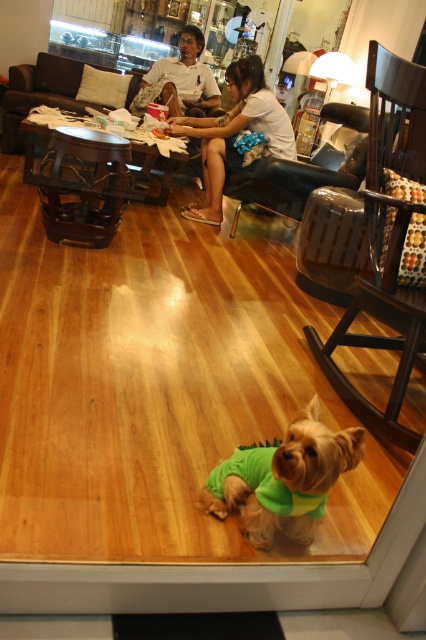
Is white cotton shirt at upper center below matte white shirt at upper center?

Correct, white cotton shirt at upper center is located below matte white shirt at upper center.

Is point (276, 138) farther from camera compared to point (199, 97)?

No, (276, 138) is in front of (199, 97).

Identify the location of white cotton shirt at upper center. Image resolution: width=426 pixels, height=640 pixels. (235, 132).

Does green fabric dog at center have a larger size compared to matte white shirt at upper center?

Result: No, green fabric dog at center is not bigger than matte white shirt at upper center.

Is green fabric dog at center above matte white shirt at upper center?

No, green fabric dog at center is not above matte white shirt at upper center.

Does point (288, 518) lie in front of point (143, 106)?

That is True.

Identify the location of green fabric dog at center. This screenshot has width=426, height=640. (284, 480).

Who is more forward, (275, 460) or (268, 113)?

Point (275, 460)

Does point (304, 474) come farther from viewer compared to point (276, 154)?

No, (304, 474) is closer to viewer.

Where is `green fabric dog at center`? The height and width of the screenshot is (640, 426). green fabric dog at center is located at coordinates (284, 480).